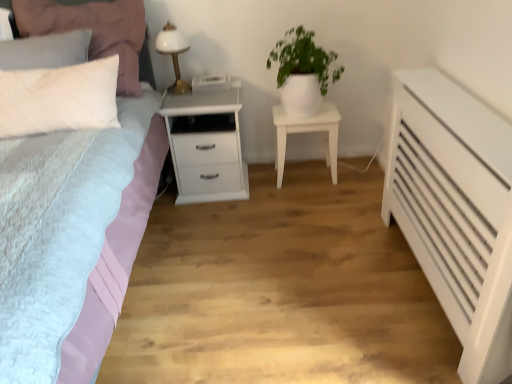
What is the approximate width of white quilted pillow at upper left?

white quilted pillow at upper left is 41.15 centimeters wide.

What are the coordinates of `white quilted pillow at upper left` in the screenshot? It's located at (92, 30).

This screenshot has height=384, width=512. Identify the location of white glossy bedside lamp at upper left. (174, 54).

Considering the relative sizes of white glossy bedside lamp at upper left and white quilted pillow at upper left in the image provided, is white glossy bedside lamp at upper left shorter than white quilted pillow at upper left?

Indeed, white glossy bedside lamp at upper left has a lesser height compared to white quilted pillow at upper left.

From a real-world perspective, who is located higher, white glossy bedside lamp at upper left or white quilted pillow at upper left?

From a 3D spatial view, white quilted pillow at upper left is above.

Is white glossy bedside lamp at upper left not near white quilted pillow at upper left?

No.

Considering the positions of objects white glossy bedside lamp at upper left and white quilted pillow at upper left in the image provided, who is more to the right, white glossy bedside lamp at upper left or white quilted pillow at upper left?

Positioned to the right is white glossy bedside lamp at upper left.

From their relative heights in the image, would you say white glossy nightstand at center, which is the first nightstand from left to right, is taller or shorter than white matte pot at upper center?

Considering their sizes, white glossy nightstand at center, which is the first nightstand from left to right, has more height than white matte pot at upper center.

Is white glossy nightstand at center, which is the first nightstand from left to right, at the left side of white matte pot at upper center?

Correct, you'll find white glossy nightstand at center, which is the first nightstand from left to right, to the left of white matte pot at upper center.

Considering the sizes of objects white glossy nightstand at center, which is the first nightstand from left to right, and white matte pot at upper center in the image provided, who is smaller, white glossy nightstand at center, which is the first nightstand from left to right, or white matte pot at upper center?

Smaller between the two is white matte pot at upper center.

Are matte pink bed at left and white matte pot at upper center far apart?

matte pink bed at left is near white matte pot at upper center, not far away.

Is matte pink bed at left facing towards white matte pot at upper center?

No.

Is point (51, 31) closer or farther from the camera than point (306, 94)?

Point (51, 31) is positioned closer to the camera compared to point (306, 94).

Which is behind, matte pink bed at left or white matte pot at upper center?

white matte pot at upper center is more distant.

Can you confirm if white matte nightstand at center, positioned as the 2th nightstand in left-to-right order, is positioned to the left of white matte pot at upper center?

No.

Between white matte nightstand at center, the 1th nightstand viewed from the right, and white matte pot at upper center, which one has less height?

white matte nightstand at center, the 1th nightstand viewed from the right, is shorter.

Does white matte nightstand at center, positioned as the 2th nightstand in left-to-right order, have a larger size compared to white matte pot at upper center?

Actually, white matte nightstand at center, positioned as the 2th nightstand in left-to-right order, might be smaller than white matte pot at upper center.

Is white matte pot at upper center inside white matte nightstand at center, the 1th nightstand viewed from the right?

No, white matte pot at upper center is not inside white matte nightstand at center, the 1th nightstand viewed from the right.

Considering the positions of objects white glossy bedside lamp at upper left and white matte pot at upper center in the image provided, who is more to the left, white glossy bedside lamp at upper left or white matte pot at upper center?

white glossy bedside lamp at upper left is more to the left.

Looking at this image, is white glossy bedside lamp at upper left next to white matte pot at upper center and touching it?

white glossy bedside lamp at upper left and white matte pot at upper center are not in contact.

Looking at the image, does white glossy bedside lamp at upper left seem bigger or smaller compared to white matte pot at upper center?

Considering their sizes, white glossy bedside lamp at upper left takes up less space than white matte pot at upper center.

From the image's perspective, is white glossy bedside lamp at upper left positioned above or below white matte pot at upper center?

Clearly, from the image's perspective, white glossy bedside lamp at upper left is above white matte pot at upper center.

Can you confirm if white matte pot at upper center is wider than matte pink bed at left?

In fact, white matte pot at upper center might be narrower than matte pink bed at left.

How much distance is there between white matte pot at upper center and matte pink bed at left?

The distance of white matte pot at upper center from matte pink bed at left is 33.96 inches.

From a real-world perspective, is white matte pot at upper center positioned under matte pink bed at left based on gravity?

Actually, white matte pot at upper center is physically above matte pink bed at left in the real world.

Image resolution: width=512 pixels, height=384 pixels. In order to click on bed on the left of the white matte pot at upper center in this screenshot , I will do `click(93, 30)`.

Considering the sizes of objects white quilted pillow at upper left and white matte pot at upper center in the image provided, who is wider, white quilted pillow at upper left or white matte pot at upper center?

With larger width is white matte pot at upper center.

Is white quilted pillow at upper left spatially inside white matte pot at upper center, or outside of it?

white quilted pillow at upper left is located beyond the bounds of white matte pot at upper center.

Based on the photo, how far apart are white quilted pillow at upper left and white matte pot at upper center?

white quilted pillow at upper left and white matte pot at upper center are 36.47 inches apart from each other.

Identify the location of houseplant below the white quilted pillow at upper left (from a real-world perspective). The width and height of the screenshot is (512, 384). pos(301,72).

Image resolution: width=512 pixels, height=384 pixels. In order to click on bedside lamp that appears on the right of white quilted pillow at upper left in this screenshot , I will do `click(174, 54)`.

Find the location of a particular element. This screenshot has width=512, height=384. nightstand that is on the left side of white matte pot at upper center is located at coordinates (206, 144).

From the image, which object appears to be farther from white matte pot at upper center, white quilted pillow at upper left or white glossy bedside lamp at upper left?

Among the two, white quilted pillow at upper left is located further to white matte pot at upper center.

From the image, which object appears to be farther from white matte pot at upper center, white glossy nightstand at center, which is the first nightstand from left to right, or matte pink bed at left?

matte pink bed at left.

Considering their positions, is white matte nightstand at center, the 1th nightstand viewed from the right, positioned closer to white matte pot at upper center than matte pink bed at left?

The object closer to white matte pot at upper center is white matte nightstand at center, the 1th nightstand viewed from the right.

From the image, which object appears to be nearer to white glossy nightstand at center, which appears as the second nightstand when viewed from the right, white quilted pillow at upper left or white matte pot at upper center?

Among the two, white matte pot at upper center is located nearer to white glossy nightstand at center, which appears as the second nightstand when viewed from the right.

Looking at the image, which one is located closer to white glossy nightstand at center, which is the first nightstand from left to right, white glossy bedside lamp at upper left or white matte nightstand at center, positioned as the 2th nightstand in left-to-right order?

The object closer to white glossy nightstand at center, which is the first nightstand from left to right, is white glossy bedside lamp at upper left.

Looking at the image, which one is located further to white glossy nightstand at center, which is the first nightstand from left to right, white matte pot at upper center or white matte nightstand at center, the 1th nightstand viewed from the right?

Among the two, white matte pot at upper center is located further to white glossy nightstand at center, which is the first nightstand from left to right.

When comparing their distances from white glossy bedside lamp at upper left, does white matte pot at upper center or matte pink bed at left seem further?

white matte pot at upper center is further to white glossy bedside lamp at upper left.

Considering their positions, is white glossy nightstand at center, which is the first nightstand from left to right, positioned closer to white quilted pillow at upper left than white glossy bedside lamp at upper left?

white glossy bedside lamp at upper left lies closer to white quilted pillow at upper left than the other object.

At what (x,y) coordinates should I click in order to perform the action: click on bedside lamp located between white quilted pillow at upper left and white matte pot at upper center in the left-right direction. Please return your answer as a coordinate pair (x, y). Looking at the image, I should click on (174, 54).

You are a GUI agent. You are given a task and a screenshot of the screen. Output one action in this format:
    pyautogui.click(x=<x>, y=<y>)
    Task: Click on the nightstand located between matte pink bed at left and white matte nightstand at center, the 1th nightstand viewed from the right, in the depth direction
    The image size is (512, 384).
    Given the screenshot: What is the action you would take?
    pyautogui.click(x=206, y=144)

This screenshot has height=384, width=512. In order to click on nightstand between white glossy bedside lamp at upper left and white matte nightstand at center, the 1th nightstand viewed from the right, from left to right in this screenshot , I will do `click(206, 144)`.

Locate an element on the screen. The image size is (512, 384). houseplant situated between white quilted pillow at upper left and white matte nightstand at center, positioned as the 2th nightstand in left-to-right order, from left to right is located at coordinates (301, 72).